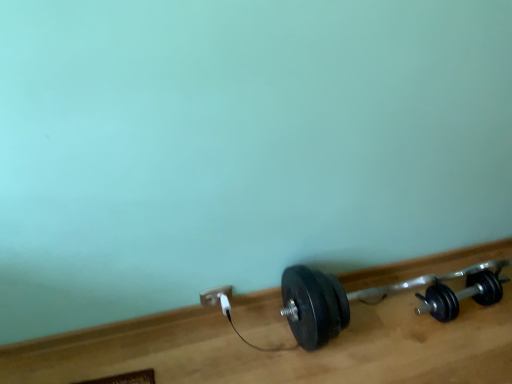
At what (x,y) coordinates should I click in order to perform the action: click on free spot to the left of black rubber dumbbell at lower right, the 2th dumbbell positioned from the left. Please return your answer as a coordinate pair (x, y). Looking at the image, I should click on (392, 317).